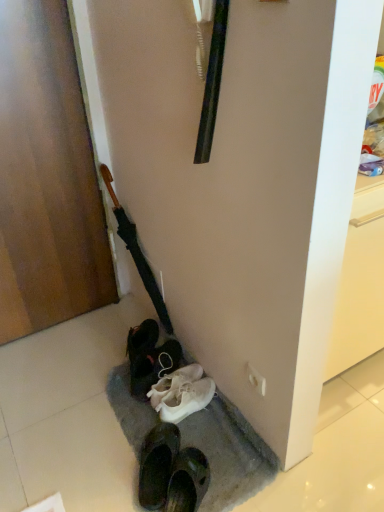
Question: Is wooden door at left taller or shorter than black matte umbrella at left?

Choices:
 (A) tall
 (B) short

Answer: (A)

Question: Based on their sizes in the image, would you say wooden door at left is bigger or smaller than black matte umbrella at left?

Choices:
 (A) big
 (B) small

Answer: (A)

Question: Estimate the real-world distances between objects in this image. Which object is farther from the wooden door at left?

Choices:
 (A) black matte umbrella at left
 (B) white matte sneakers at lower center

Answer: (B)

Question: Estimate the real-world distances between objects in this image. Which object is closer to the wooden door at left?

Choices:
 (A) white matte sneakers at lower center
 (B) black matte umbrella at left

Answer: (B)